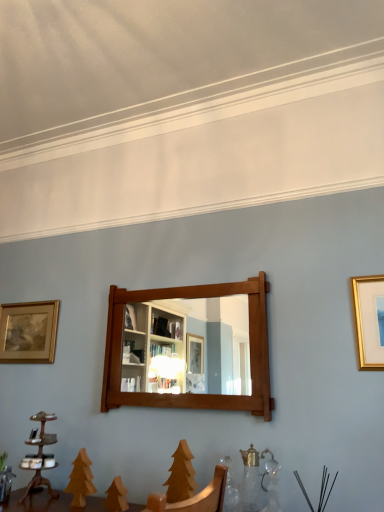
Question: Can you confirm if mahogany wooden mirror at center is positioned to the left of gold metallic picture frame at upper right, which appears as the first picture frame when viewed from the front?

Choices:
 (A) yes
 (B) no

Answer: (A)

Question: From a real-world perspective, is mahogany wooden mirror at center under gold metallic picture frame at upper right, acting as the 2th picture frame starting from the back?

Choices:
 (A) no
 (B) yes

Answer: (B)

Question: Does mahogany wooden mirror at center have a smaller size compared to gold metallic picture frame at upper right, the 1th picture frame in the right-to-left sequence?

Choices:
 (A) no
 (B) yes

Answer: (A)

Question: Considering the relative positions of mahogany wooden mirror at center and gold metallic picture frame at upper right, arranged as the second picture frame when viewed from the left, in the image provided, is mahogany wooden mirror at center in front of gold metallic picture frame at upper right, arranged as the second picture frame when viewed from the left,?

Choices:
 (A) no
 (B) yes

Answer: (A)

Question: Is the depth of mahogany wooden mirror at center greater than that of gold metallic picture frame at upper right, which appears as the first picture frame when viewed from the front?

Choices:
 (A) no
 (B) yes

Answer: (B)

Question: Are mahogany wooden mirror at center and gold metallic picture frame at upper right, acting as the 2th picture frame starting from the back, far apart?

Choices:
 (A) yes
 (B) no

Answer: (B)

Question: Can you confirm if gold metallic picture frame at upper right, arranged as the second picture frame when viewed from the left, is shorter than wooden candle holder at lower left?

Choices:
 (A) yes
 (B) no

Answer: (B)

Question: From the image's perspective, is gold metallic picture frame at upper right, which appears as the first picture frame when viewed from the front, above wooden candle holder at lower left?

Choices:
 (A) yes
 (B) no

Answer: (A)

Question: Does gold metallic picture frame at upper right, acting as the 2th picture frame starting from the back, have a larger size compared to wooden candle holder at lower left?

Choices:
 (A) yes
 (B) no

Answer: (B)

Question: Would you say gold metallic picture frame at upper right, the 1th picture frame in the right-to-left sequence, contains wooden candle holder at lower left?

Choices:
 (A) no
 (B) yes

Answer: (A)

Question: Is wooden candle holder at lower left at the back of gold metallic picture frame at upper right, arranged as the second picture frame when viewed from the left?

Choices:
 (A) no
 (B) yes

Answer: (A)

Question: Considering the relative sizes of gold metallic picture frame at upper right, which appears as the first picture frame when viewed from the front, and wooden candle holder at lower left in the image provided, is gold metallic picture frame at upper right, which appears as the first picture frame when viewed from the front, thinner than wooden candle holder at lower left?

Choices:
 (A) yes
 (B) no

Answer: (A)

Question: From the image's perspective, is gold-framed painting at left, which is the 1th picture frame in left-to-right order, located beneath gold metallic picture frame at upper right, acting as the 2th picture frame starting from the back?

Choices:
 (A) yes
 (B) no

Answer: (A)